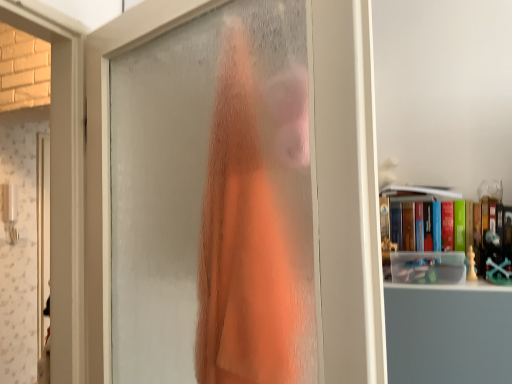
Question: Is orange fabric at center inside or outside of frosted glass door at center?

Choices:
 (A) outside
 (B) inside

Answer: (B)

Question: Is point (239, 39) positioned closer to the camera than point (95, 205)?

Choices:
 (A) closer
 (B) farther

Answer: (A)

Question: Which of these objects is positioned closest to the orange fabric at center?

Choices:
 (A) hardcover book at upper right
 (B) frosted glass door at center

Answer: (B)

Question: Which object is the closest to the orange fabric at center?

Choices:
 (A) hardcover book at upper right
 (B) frosted glass door at center

Answer: (B)